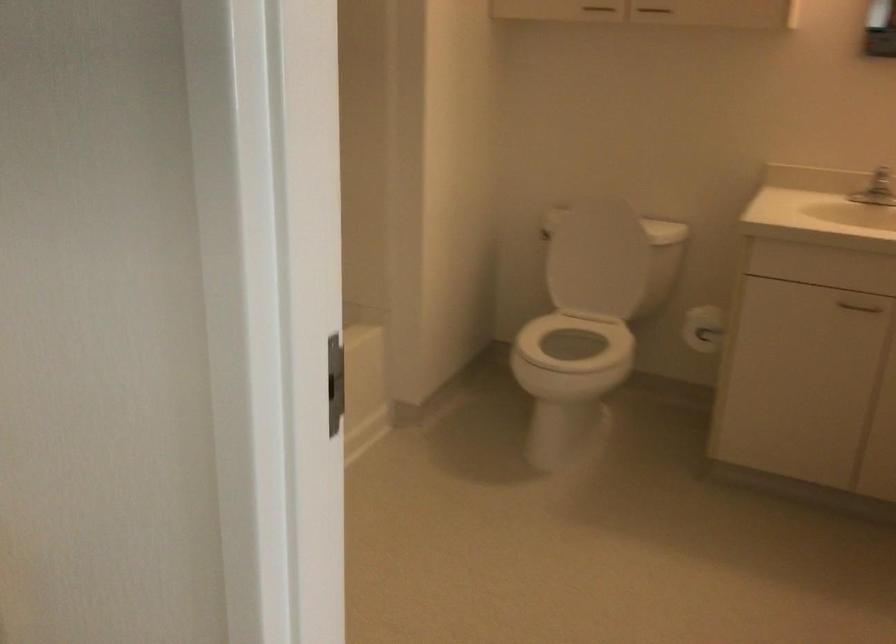
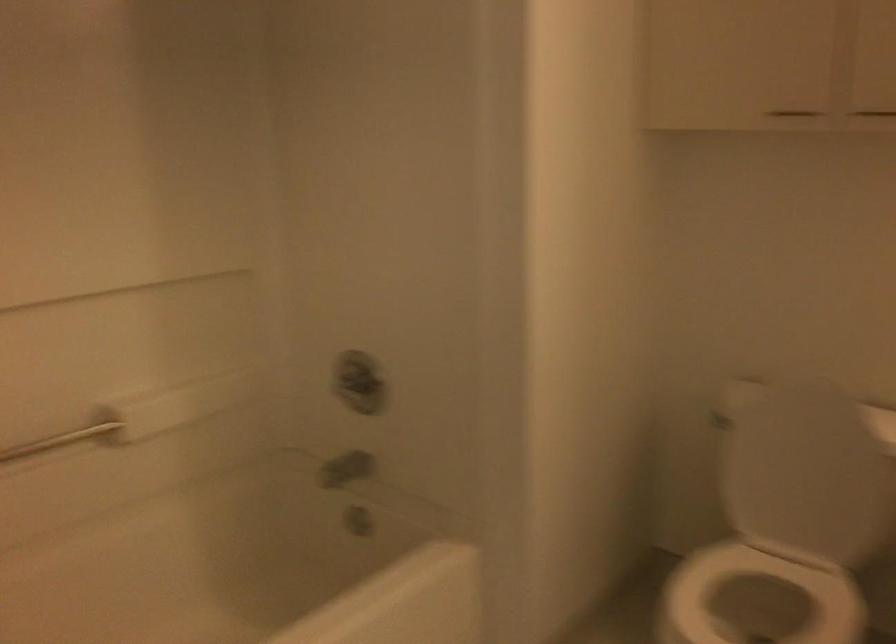
Question: The first image is from the beginning of the video and the second image is from the end. How did the camera likely rotate when shooting the video?

Choices:
 (A) Left
 (B) Right
 (C) Up
 (D) Down

Answer: (A)